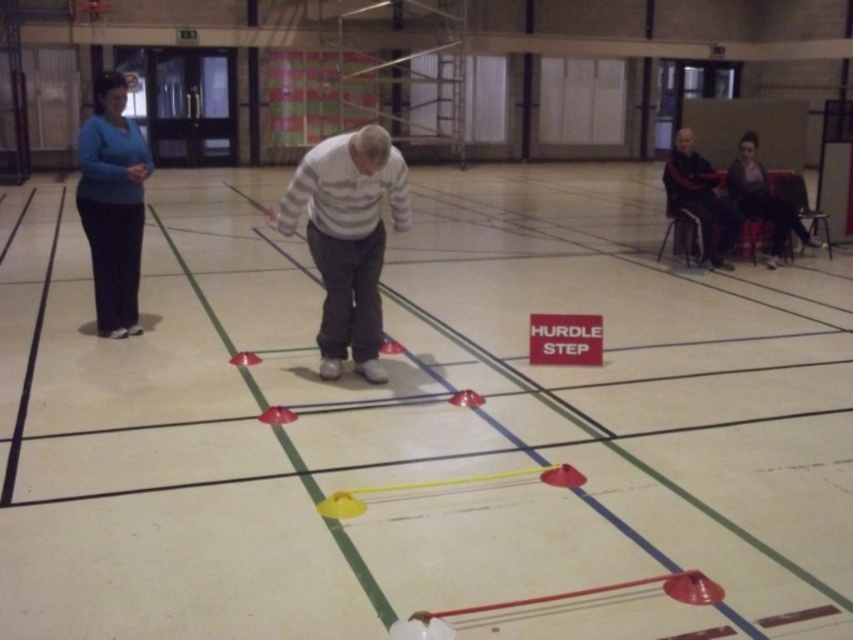
You are a participant in the gym class and need to retrieve your jacket before the next exercise. Which item should you reach for first, the white striped sweater at center or the dark gray fabric jacket at upper right, if you want to grab the one closer to you?

You should reach for the white striped sweater at center first because it is closer to you than the dark gray fabric jacket at upper right.

You are a participant in the gym class and need to move to the back of the line. Which direction should you go relative to the white striped sweater at center and the dark gray sweater at upper right?

You should move behind the white striped sweater at center since it is in front of the dark gray sweater at upper right, meaning the line progresses from the white to the dark gray sweater.

Based on the photo, you are a fitness instructor in the gymnasium. You need to adjust the distance between the dark gray sweater at upper right and the red plastic cone at center to 20 feet for the next exercise. Is the current distance sufficient? Please explain.

The dark gray sweater at upper right and red plastic cone at center are currently 21.67 feet apart. Since 21.67 feet is greater than 20 feet, the current distance is sufficient but slightly longer than required. You may choose to move them closer to meet the exact 20 feet requirement.